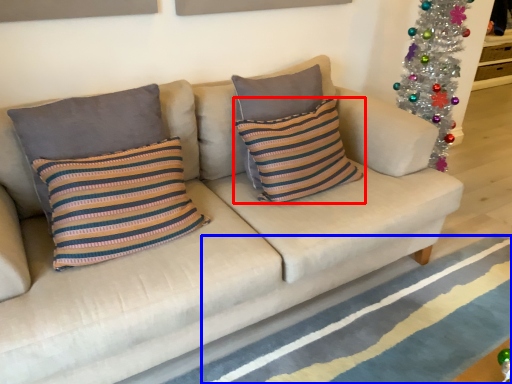
Question: Which point is closer to the camera, pillow (highlighted by a red box) or stripe (highlighted by a blue box)?

Choices:
 (A) pillow
 (B) stripe

Answer: (B)